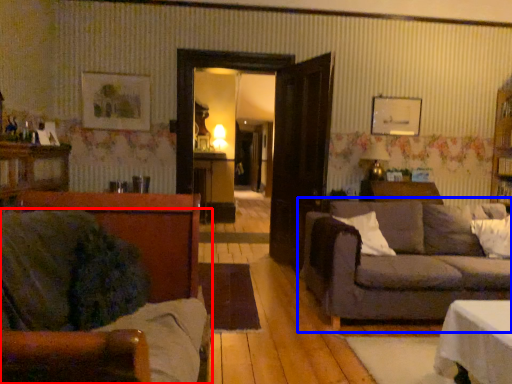
Question: Which object is closer to the camera taking this photo, studio couch (highlighted by a red box) or studio couch (highlighted by a blue box)?

Choices:
 (A) studio couch
 (B) studio couch

Answer: (A)